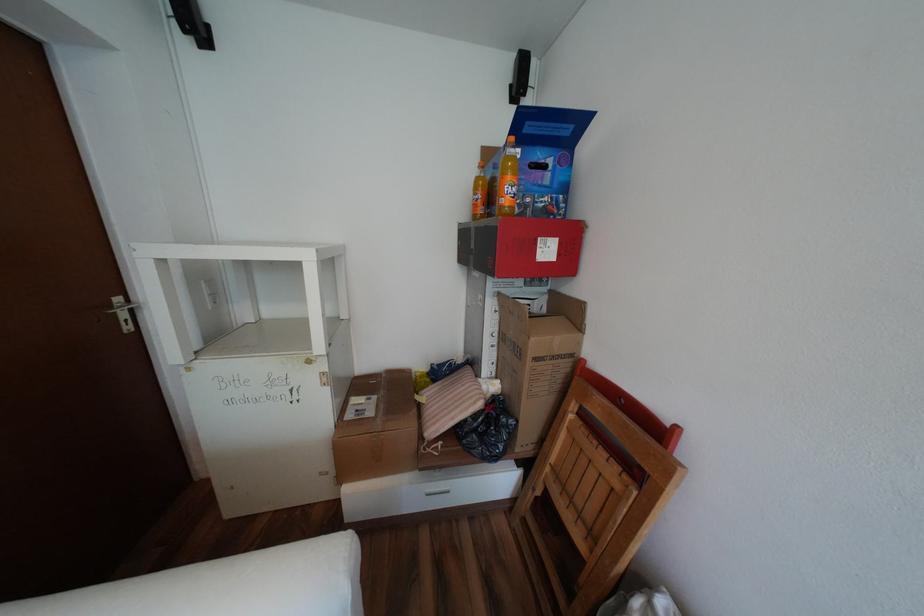
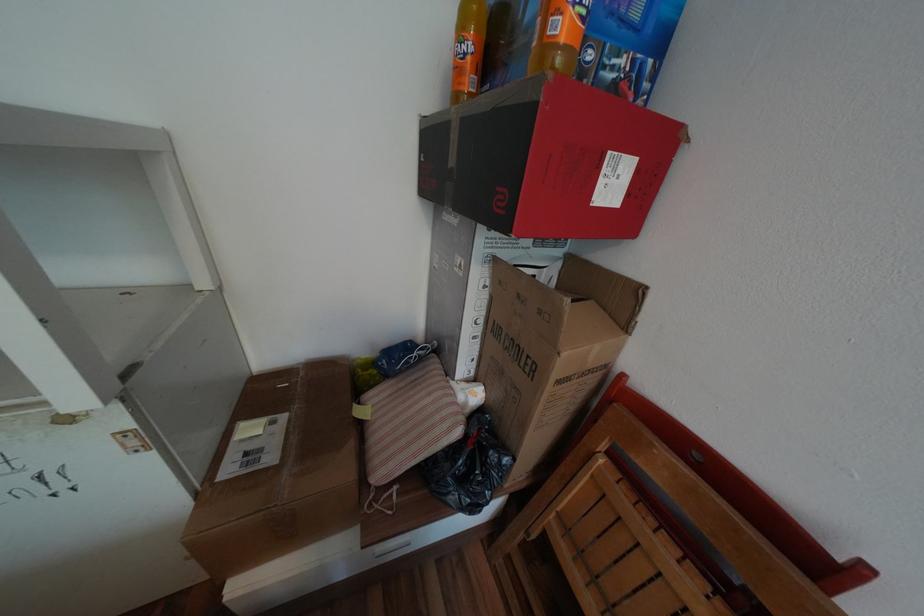
Question: In a continuous first-person perspective shot, in which direction is the camera moving?

Choices:
 (A) Left
 (B) Right
 (C) Forward
 (D) Backward

Answer: (C)